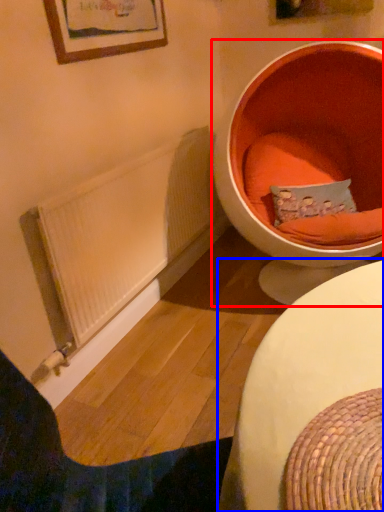
Question: Which object is closer to the camera taking this photo, toilet (highlighted by a red box) or table (highlighted by a blue box)?

Choices:
 (A) toilet
 (B) table

Answer: (B)